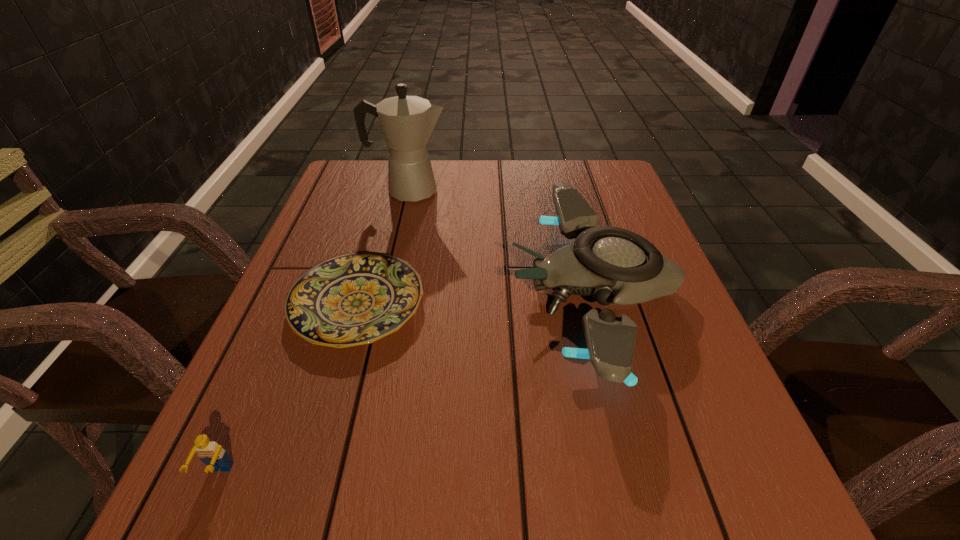
This screenshot has height=540, width=960. Identify the location of vacant point located on the front-facing side of the third shortest object. (332, 290).

You are a GUI agent. You are given a task and a screenshot of the screen. Output one action in this format:
    pyautogui.click(x=<x>, y=<y>)
    Task: Click on the free space located on the face of the Lego
    The width and height of the screenshot is (960, 540).
    Given the screenshot: What is the action you would take?
    pyautogui.click(x=190, y=537)

This screenshot has width=960, height=540. I want to click on vacant area situated on the back of the plate, so click(x=376, y=239).

This screenshot has height=540, width=960. I want to click on object present at the far edge, so click(407, 122).

Identify the location of object present at the near edge. (212, 454).

I want to click on coffeepot present at the left edge, so click(x=407, y=122).

Locate an element on the screen. The height and width of the screenshot is (540, 960). Lego present at the left edge is located at coordinates (212, 454).

Image resolution: width=960 pixels, height=540 pixels. I want to click on plate that is positioned at the left edge, so click(x=353, y=299).

I want to click on object located in the right edge section of the desktop, so click(614, 265).

Locate an element on the screen. Image resolution: width=960 pixels, height=540 pixels. object present at the far left corner is located at coordinates (407, 122).